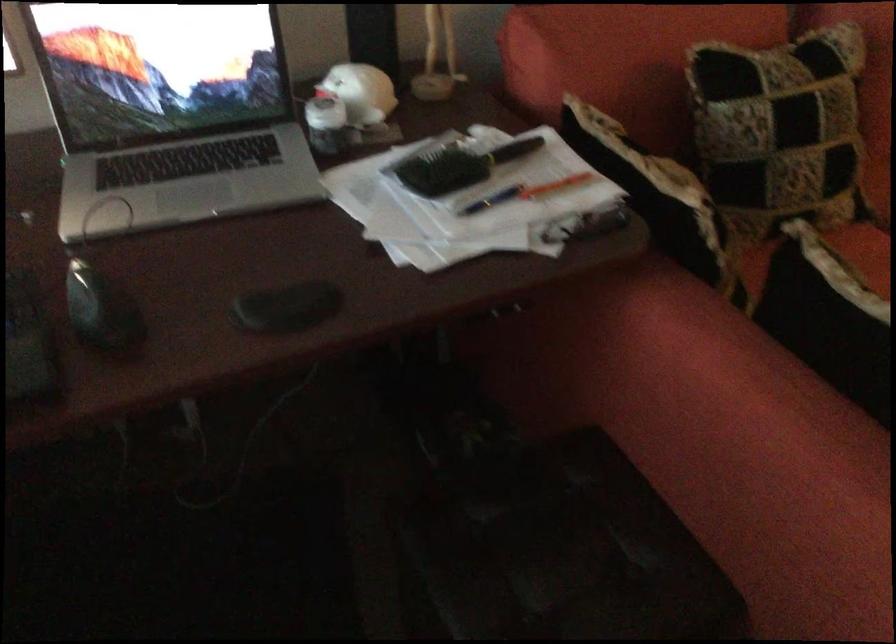
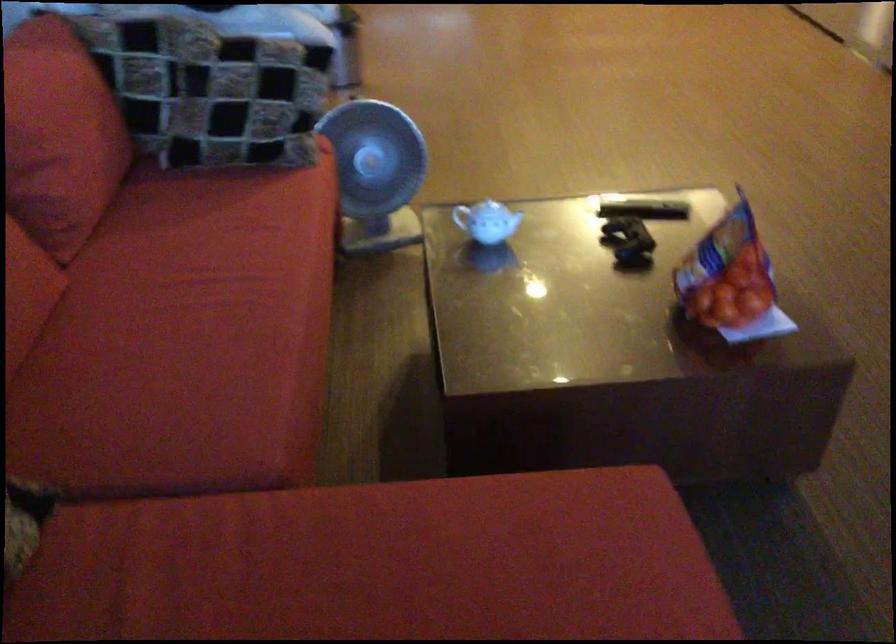
The images are taken continuously from a first-person perspective. In which direction is your viewpoint rotating?

The camera rotated toward right-down.